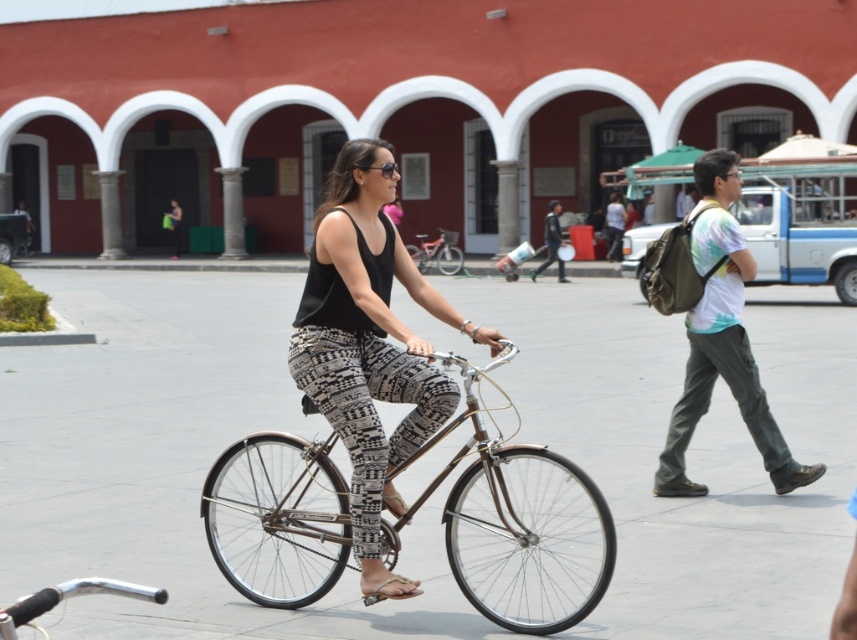
Which of these two, light brown leather jacket at center or light blue tie-dye shirt at center, stands taller?

Standing taller between the two is light blue tie-dye shirt at center.

Which is in front, point (546, 221) or point (621, 212)?

Point (546, 221) is more forward.

This screenshot has height=640, width=857. What are the coordinates of `light brown leather jacket at center` in the screenshot? It's located at (550, 241).

Can you confirm if black matte tank top at center is taller than matte black tank top at center?

Indeed, black matte tank top at center has a greater height compared to matte black tank top at center.

Is black matte tank top at center smaller than matte black tank top at center?

No.

Who is more distant from viewer, (346,324) or (174,218)?

The point (174,218) is more distant.

Locate an element on the screen. This screenshot has height=640, width=857. black matte tank top at center is located at coordinates (369, 346).

Does light brown leather jacket at center appear under matte black tank top at center?

Yes, light brown leather jacket at center is below matte black tank top at center.

Is light brown leather jacket at center wider than matte black tank top at center?

No.

What do you see at coordinates (550, 241) in the screenshot?
I see `light brown leather jacket at center` at bounding box center [550, 241].

Locate an element on the screen. light brown leather jacket at center is located at coordinates (550, 241).